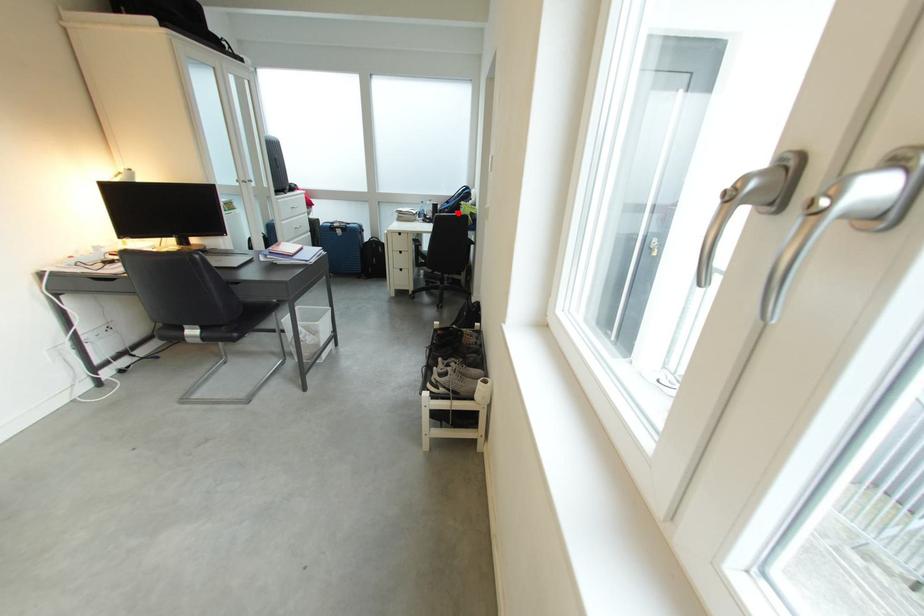
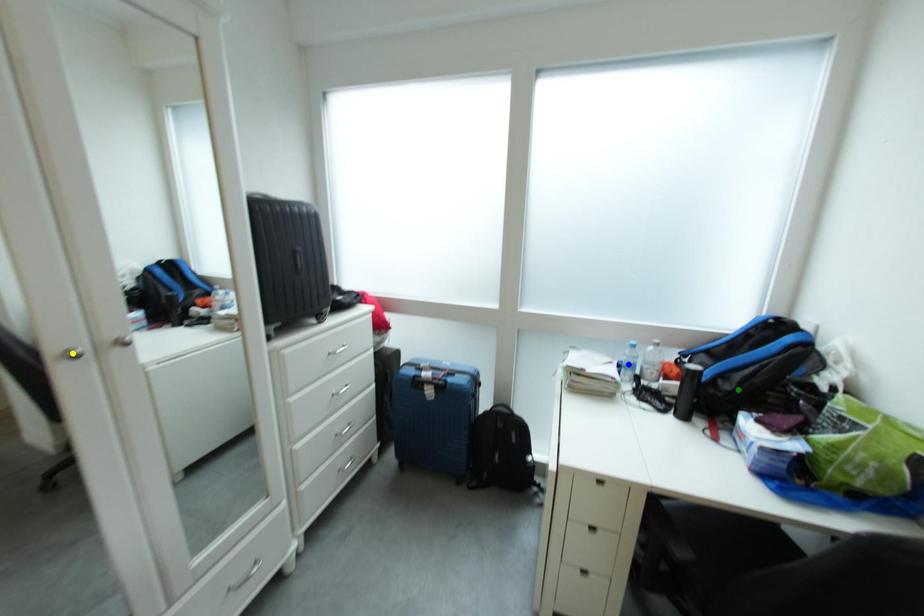
Question: I am providing you with two images of the same scene from different viewpoints. A red point is marked on the first image. You are given multiple points on the second image. Which mark in image 2 goes with the point in image 1?

Choices:
 (A) blue point
 (B) yellow point
 (C) green point

Answer: (C)